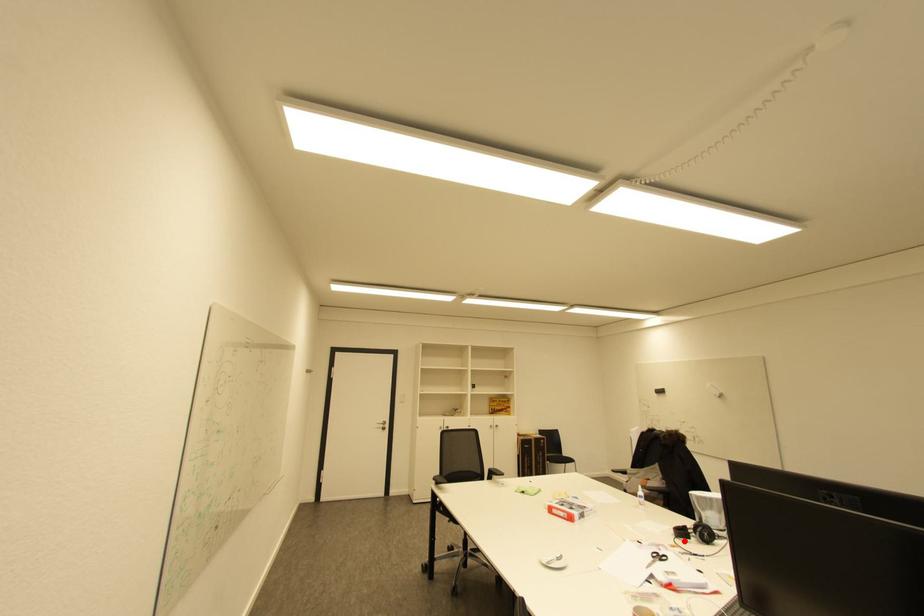
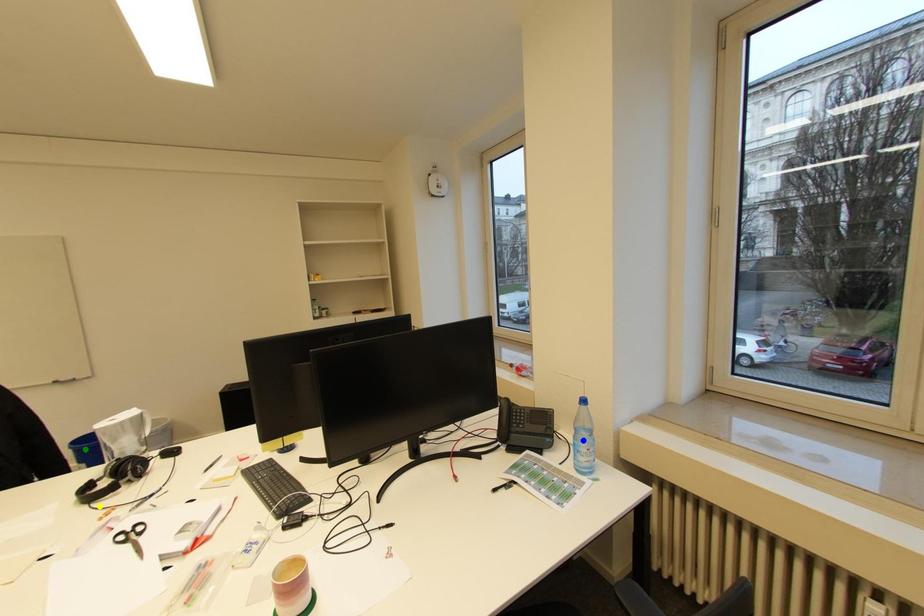
Question: I am providing you with two images of the same scene from different viewpoints. A red point is marked on the first image. You are given multiple points on the second image. Which spot in image 2 lines up with the point in image 1?

Choices:
 (A) blue point
 (B) yellow point
 (C) green point

Answer: (B)